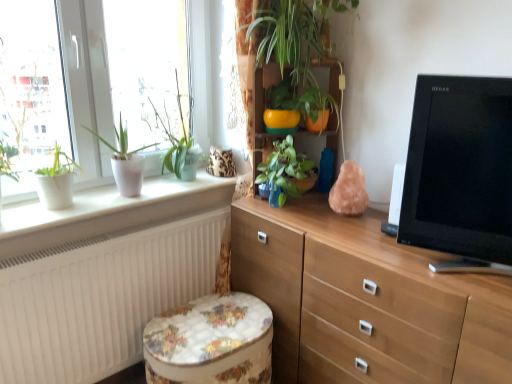
Question: Can you confirm if wooden cabinet at center is thinner than white glossy window at upper left?

Choices:
 (A) yes
 (B) no

Answer: (B)

Question: Is wooden cabinet at center far away from white glossy window at upper left?

Choices:
 (A) yes
 (B) no

Answer: (B)

Question: Is the depth of wooden cabinet at center greater than that of white glossy window at upper left?

Choices:
 (A) yes
 (B) no

Answer: (A)

Question: Can you confirm if wooden cabinet at center is taller than white glossy window at upper left?

Choices:
 (A) yes
 (B) no

Answer: (B)

Question: Can you confirm if wooden cabinet at center is bigger than white glossy window at upper left?

Choices:
 (A) no
 (B) yes

Answer: (A)

Question: From a real-world perspective, is wooden cabinet at center below white glossy window at upper left?

Choices:
 (A) yes
 (B) no

Answer: (A)

Question: Considering the relative positions of white matte radiator at lower left and black glossy tv at right in the image provided, is white matte radiator at lower left in front of black glossy tv at right?

Choices:
 (A) no
 (B) yes

Answer: (A)

Question: Is white matte radiator at lower left beside black glossy tv at right?

Choices:
 (A) yes
 (B) no

Answer: (B)

Question: Considering the relative positions of white matte radiator at lower left and black glossy tv at right in the image provided, is white matte radiator at lower left to the right of black glossy tv at right from the viewer's perspective?

Choices:
 (A) yes
 (B) no

Answer: (B)

Question: Does white matte radiator at lower left have a greater height compared to black glossy tv at right?

Choices:
 (A) no
 (B) yes

Answer: (B)

Question: Is white matte radiator at lower left further to the viewer compared to black glossy tv at right?

Choices:
 (A) yes
 (B) no

Answer: (A)

Question: Does white matte radiator at lower left have a lesser height compared to black glossy tv at right?

Choices:
 (A) yes
 (B) no

Answer: (B)

Question: Considering the relative sizes of clear glass window at upper left and green glossy plant at center, the 2th houseplant positioned from the right, in the image provided, is clear glass window at upper left bigger than green glossy plant at center, the 2th houseplant positioned from the right,?

Choices:
 (A) yes
 (B) no

Answer: (A)